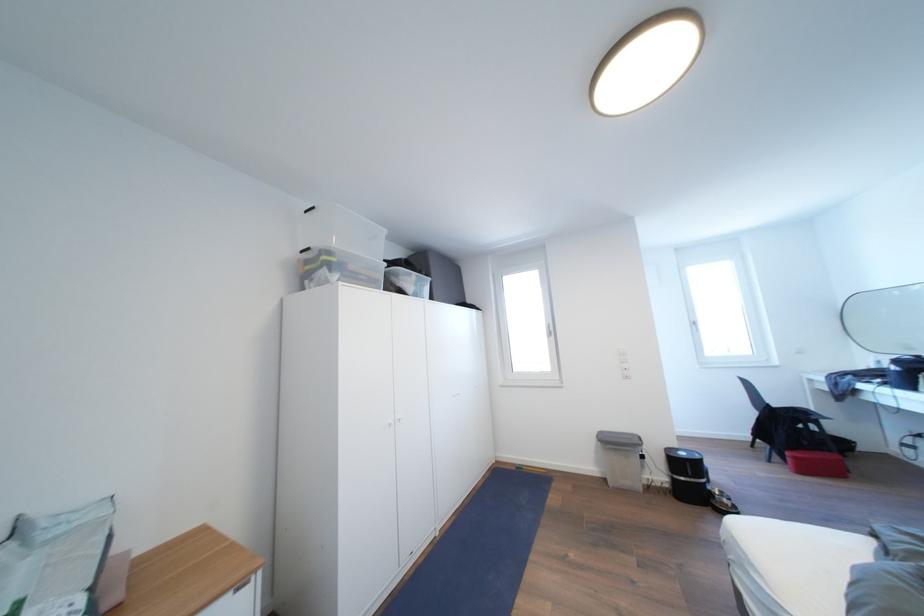
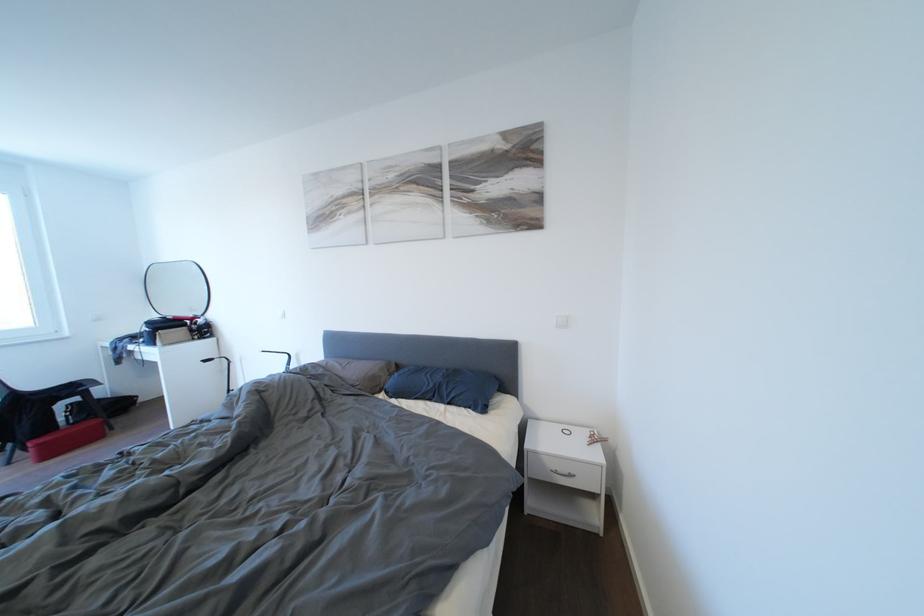
The point at (803,463) is marked in the first image. Where is the corresponding point in the second image?

(46, 450)